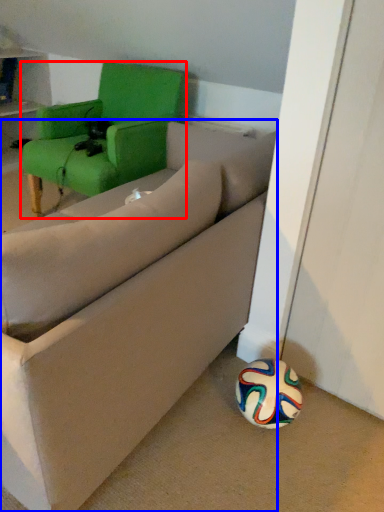
Question: Which object is closer to the camera taking this photo, chair (highlighted by a red box) or studio couch (highlighted by a blue box)?

Choices:
 (A) chair
 (B) studio couch

Answer: (B)